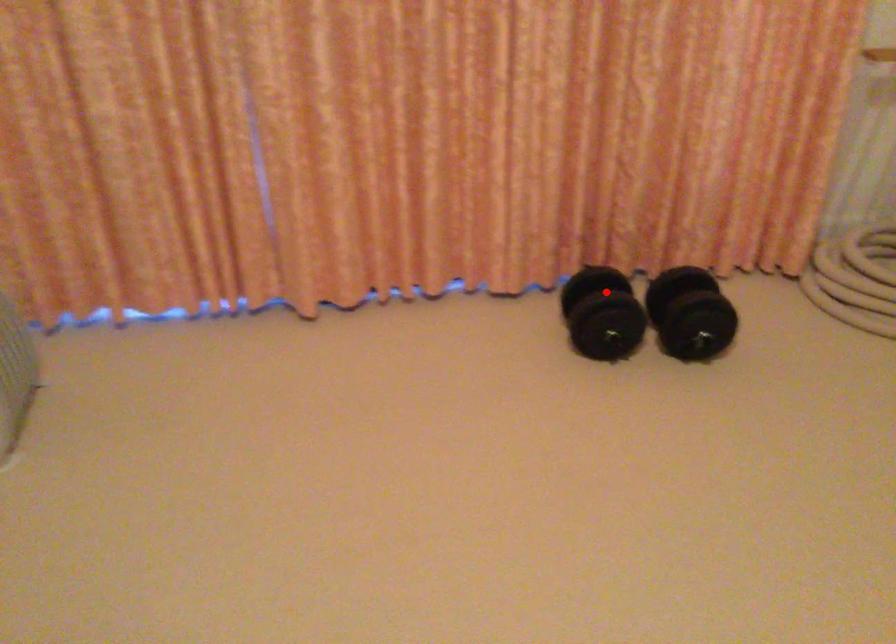
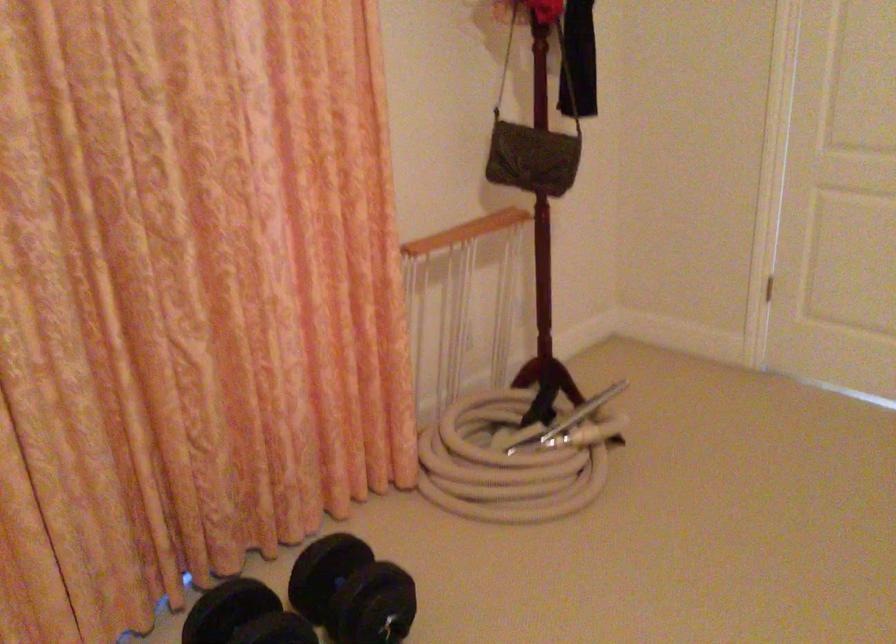
Find the pixel in the second image that matches the highlighted location in the first image.

(244, 617)